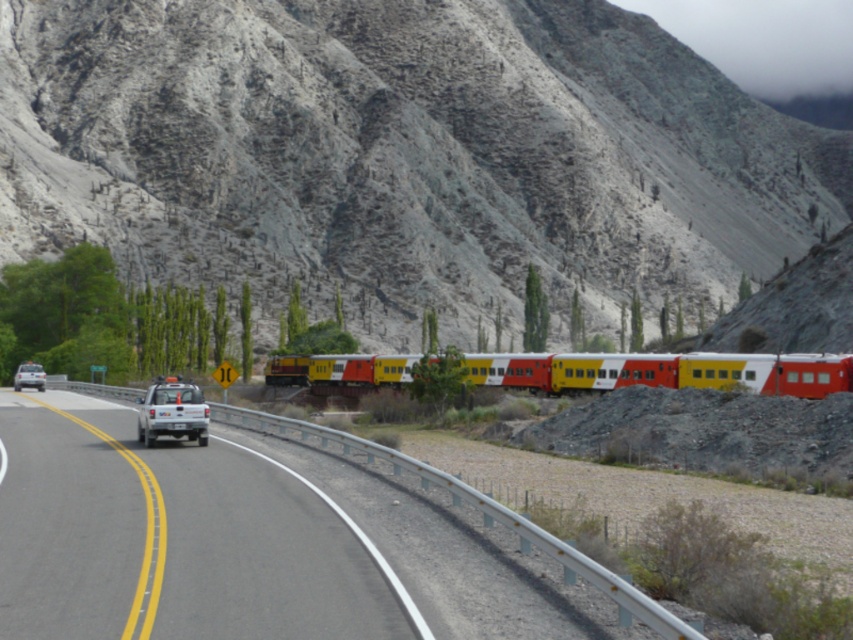
You are a photographer standing at the roadside. You want to take a photo that includes both the rugged stone mountain at center and the white matte truck at center. Which object will appear larger in the photo?

The rugged stone mountain at center will appear larger in the photo because it is much taller than the white matte truck at center.

You are a driver approaching the intersection where the road and railway cross. The white SUV is on your right side. You see the yellow matte train at center represented by point (663,371). Can you determine if the train is on the same side of the road as the white SUV?

The yellow matte train at center represented by point (663,371) is on the same side of the road as the white SUV. Both are positioned to the right of the road.

Based on the photo, you are a driver approaching the intersection where the yellow matte train at center and the white matte truck at center are located. Which vehicle is closer to your right side?

The yellow matte train at center is positioned on the right side of the white matte truck at center, so the yellow matte train at center is closer to your right side.